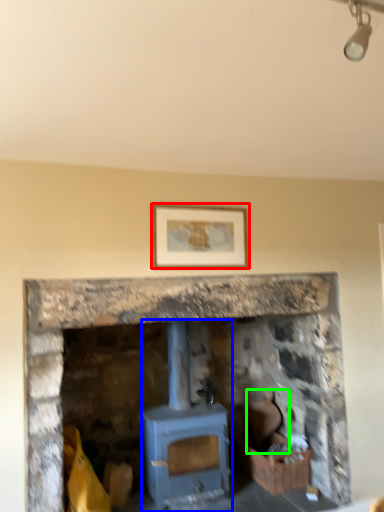
Question: Based on their relative distances, which object is nearer to picture frame (highlighted by a red box)? Choose from wood burning stove (highlighted by a blue box) and chair (highlighted by a green box).

Choices:
 (A) wood burning stove
 (B) chair

Answer: (A)